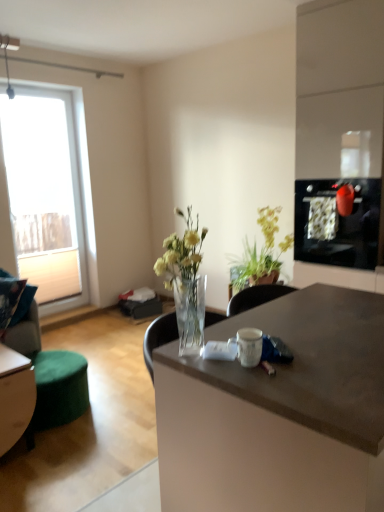
Question: Is green leafy plant at center taller or shorter than green fabric ottoman at lower left?

Choices:
 (A) tall
 (B) short

Answer: (A)

Question: From the image's perspective, is green leafy plant at center located above or below green fabric ottoman at lower left?

Choices:
 (A) below
 (B) above

Answer: (B)

Question: Based on their relative distances, which object is farther from the matte black oven at right?

Choices:
 (A) white matte coffee cup at center
 (B) black glass screen door at upper right
 (C) green leafy plant at center
 (D) green fabric swivel chair at lower left
 (E) transparent glass window at left

Answer: (E)

Question: Based on their relative distances, which object is nearer to the black glass screen door at upper right?

Choices:
 (A) green fabric swivel chair at lower left
 (B) white matte coffee cup at center
 (C) green leafy plant at center
 (D) matte black oven at right
 (E) green fabric ottoman at lower left

Answer: (D)